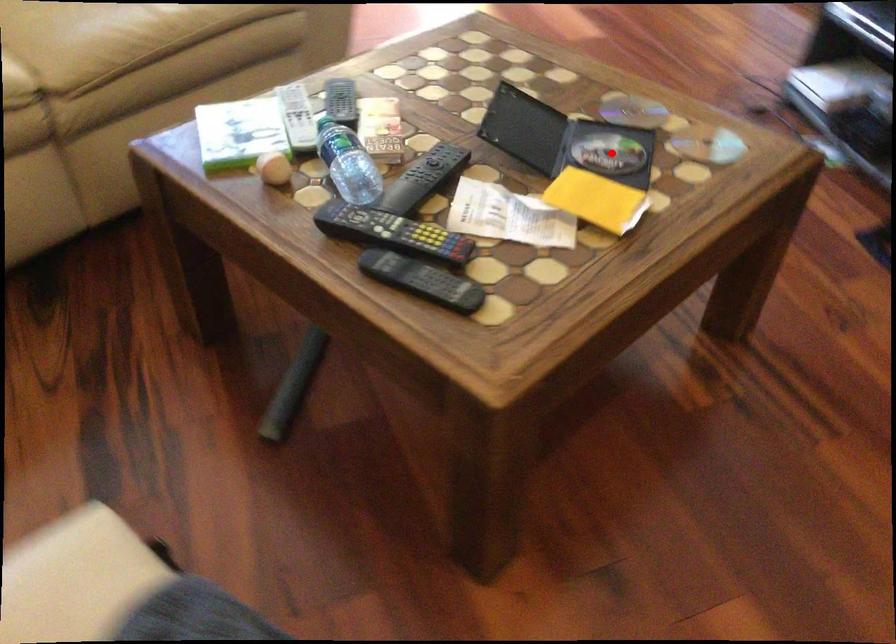
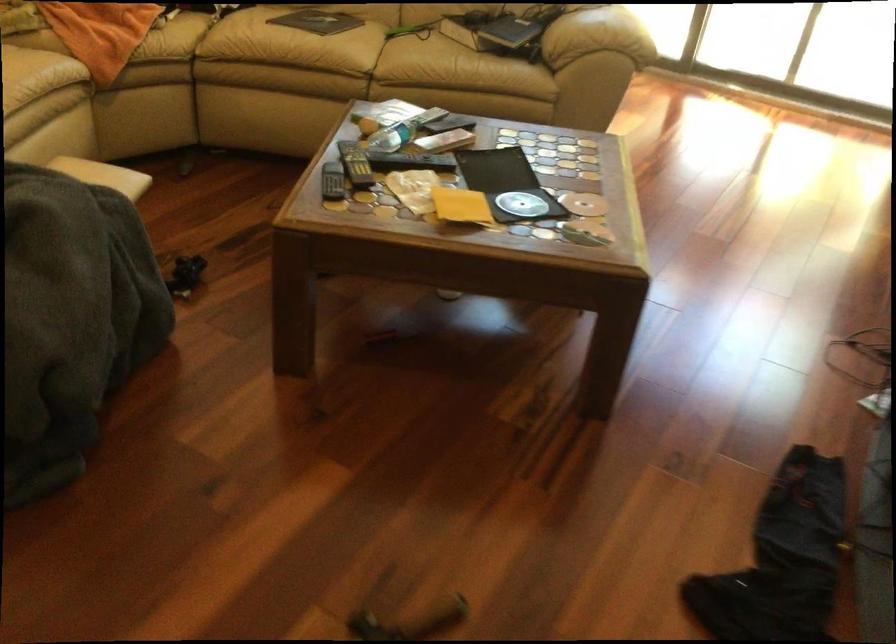
Where in the second image is the point corresponding to the highlighted location from the first image?

(521, 204)